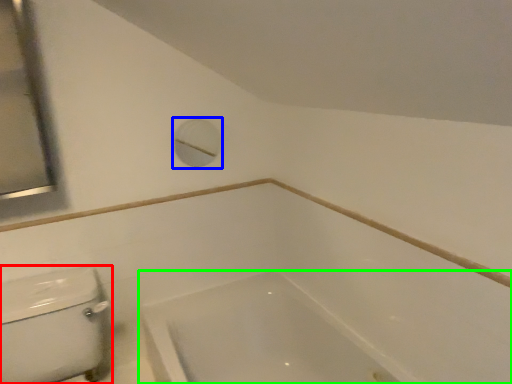
Question: Which object is positioned farthest from porcelain (highlighted by a red box)? Select from porthole (highlighted by a blue box) and bathtub (highlighted by a green box).

Choices:
 (A) porthole
 (B) bathtub

Answer: (A)